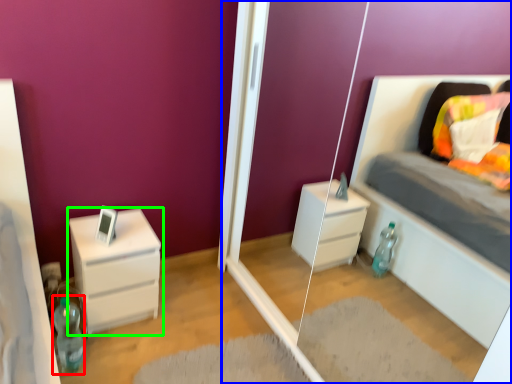
Question: Which object is the farthest from bottle (highlighted by a red box)? Choose among these: glass door (highlighted by a blue box) or chest of drawers (highlighted by a green box).

Choices:
 (A) glass door
 (B) chest of drawers

Answer: (A)